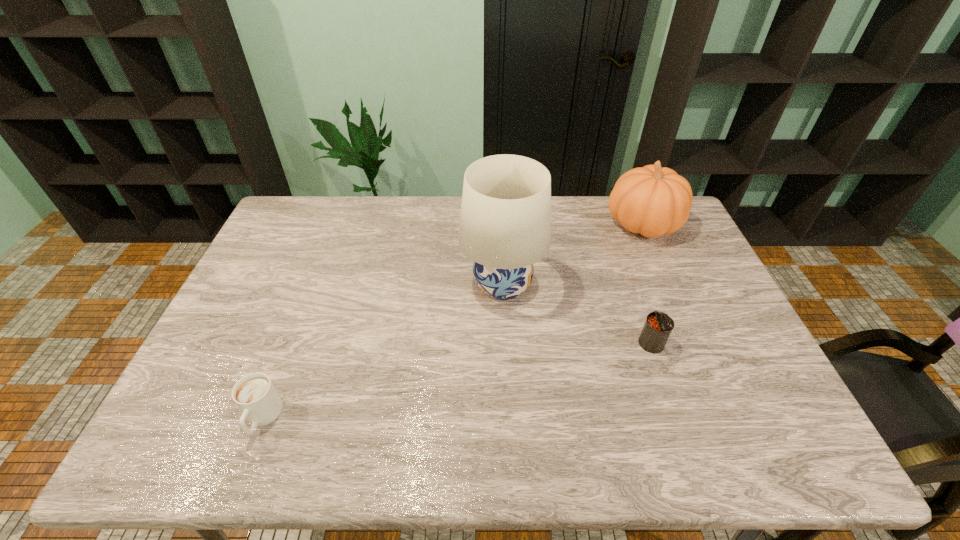
You are a GUI agent. You are given a task and a screenshot of the screen. Output one action in this format:
    pyautogui.click(x=<x>, y=<y>)
    Task: Click on the vacant space at the right edge of the desktop
    
    Given the screenshot: What is the action you would take?
    pyautogui.click(x=684, y=245)

Locate an element on the screen. free region at the far left corner is located at coordinates (298, 218).

Locate an element on the screen. The width and height of the screenshot is (960, 540). vacant point at the near right corner is located at coordinates (745, 444).

Where is `vacant area that lies between the leftmost object and the can`? vacant area that lies between the leftmost object and the can is located at coordinates (457, 381).

The image size is (960, 540). Identify the location of free space between the third object from right to left and the farthest object. (572, 254).

Where is `empty space between the second farthest object and the farthest object`? The image size is (960, 540). empty space between the second farthest object and the farthest object is located at coordinates (572, 254).

Locate an element on the screen. vacant space that is in between the third nearest object and the second tallest object is located at coordinates (572, 254).

Find the location of `empty space between the third tallest object and the cappuccino`. empty space between the third tallest object and the cappuccino is located at coordinates (457, 381).

Find the location of a particular element. unoccupied area between the cappuccino and the tallest object is located at coordinates (382, 352).

Identify the location of free spot between the shortest object and the farthest object. Image resolution: width=960 pixels, height=540 pixels. (452, 321).